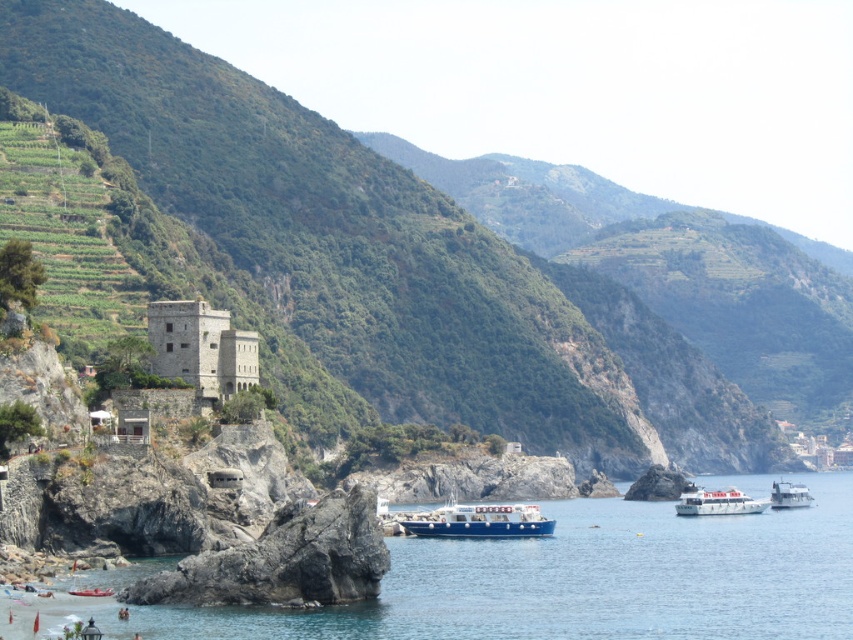
Question: Can you confirm if blue matte boat at center is positioned above white glossy ferry at center?

Choices:
 (A) yes
 (B) no

Answer: (A)

Question: Which is farther from the blue matte boat at center?

Choices:
 (A) clear blue water at lower left
 (B) white glossy ferry at center

Answer: (B)

Question: Estimate the real-world distances between objects in this image. Which object is farther from the clear blue water at lower left?

Choices:
 (A) white glossy ferry at center
 (B) white glossy boat at lower right
 (C) blue matte boat at center

Answer: (B)

Question: Which object is positioned farthest from the white glossy ferry at center?

Choices:
 (A) white glossy boat at lower right
 (B) blue matte boat at center
 (C) clear blue water at lower left

Answer: (C)

Question: Can you confirm if clear blue water at lower left is thinner than white glossy ferry at center?

Choices:
 (A) no
 (B) yes

Answer: (A)

Question: Can you confirm if white glossy ferry at center is positioned above white glossy boat at lower right?

Choices:
 (A) no
 (B) yes

Answer: (B)